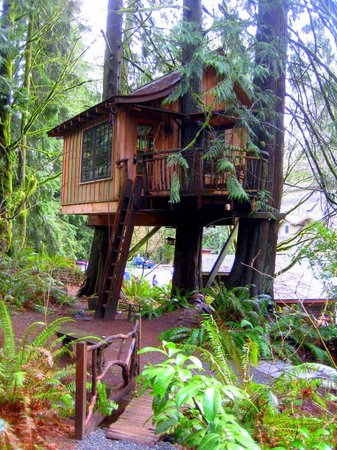
Locate an element on the screen. wooden bench is located at coordinates (77, 334).